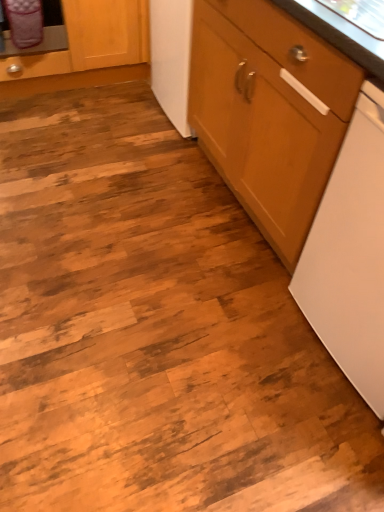
Question: Considering the relative sizes of wooden cabinet at upper left, arranged as the 2th cabinetry when viewed from the right, and wooden cabinet at right, the 2th cabinetry positioned from the left, in the image provided, is wooden cabinet at upper left, arranged as the 2th cabinetry when viewed from the right, wider than wooden cabinet at right, the 2th cabinetry positioned from the left,?

Choices:
 (A) yes
 (B) no

Answer: (A)

Question: From a real-world perspective, is wooden cabinet at upper left, arranged as the 2th cabinetry when viewed from the right, over wooden cabinet at right, the 2th cabinetry positioned from the left?

Choices:
 (A) no
 (B) yes

Answer: (A)

Question: Is wooden cabinet at upper left, arranged as the 2th cabinetry when viewed from the right, oriented towards wooden cabinet at right, the 2th cabinetry positioned from the left?

Choices:
 (A) yes
 (B) no

Answer: (A)

Question: Is wooden cabinet at upper left, arranged as the 2th cabinetry when viewed from the right, oriented away from wooden cabinet at right, the 2th cabinetry positioned from the left?

Choices:
 (A) yes
 (B) no

Answer: (B)

Question: From a real-world perspective, is wooden cabinet at upper left, the first cabinetry when ordered from left to right, located beneath wooden cabinet at right, the first cabinetry positioned from the right?

Choices:
 (A) yes
 (B) no

Answer: (A)

Question: Does wooden cabinet at upper left, the first cabinetry when ordered from left to right, have a greater height compared to wooden cabinet at right, the first cabinetry positioned from the right?

Choices:
 (A) yes
 (B) no

Answer: (B)

Question: Considering the relative sizes of wooden cabinet at right, the 2th cabinetry positioned from the left, and wooden cabinet at upper left, arranged as the 2th cabinetry when viewed from the right, in the image provided, is wooden cabinet at right, the 2th cabinetry positioned from the left, taller than wooden cabinet at upper left, arranged as the 2th cabinetry when viewed from the right,?

Choices:
 (A) yes
 (B) no

Answer: (A)

Question: Is wooden cabinet at right, the first cabinetry positioned from the right, smaller than wooden cabinet at upper left, the first cabinetry when ordered from left to right?

Choices:
 (A) yes
 (B) no

Answer: (B)

Question: From a real-world perspective, is wooden cabinet at right, the 2th cabinetry positioned from the left, located higher than wooden cabinet at upper left, the first cabinetry when ordered from left to right?

Choices:
 (A) no
 (B) yes

Answer: (B)

Question: From a real-world perspective, is wooden cabinet at right, the 2th cabinetry positioned from the left, positioned under wooden cabinet at upper left, the first cabinetry when ordered from left to right, based on gravity?

Choices:
 (A) yes
 (B) no

Answer: (B)

Question: Is wooden cabinet at upper left, the first cabinetry when ordered from left to right, inside wooden cabinet at right, the 2th cabinetry positioned from the left?

Choices:
 (A) yes
 (B) no

Answer: (B)

Question: From the image's perspective, is wooden cabinet at right, the first cabinetry positioned from the right, below wooden cabinet at upper left, arranged as the 2th cabinetry when viewed from the right?

Choices:
 (A) no
 (B) yes

Answer: (B)

Question: Is wooden cabinet at right, the 2th cabinetry positioned from the left, outside of white matte dishwasher at right?

Choices:
 (A) no
 (B) yes

Answer: (B)